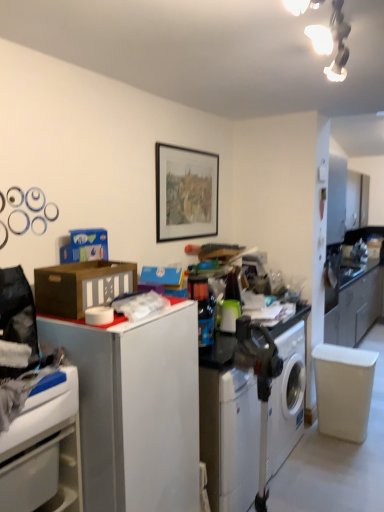
At what (x,y) coordinates should I click in order to perform the action: click on white glossy cabinet at lower left. Please return your answer as a coordinate pair (x, y). Looking at the image, I should click on (44, 452).

What do you see at coordinates (186, 193) in the screenshot? This screenshot has width=384, height=512. I see `matte black picture frame at center` at bounding box center [186, 193].

In order to face matte black picture frame at center, should I rotate leftwards or rightwards?

Rotate your view right by about 0.075°.

Locate an element on the screen. The image size is (384, 512). brown cardboard box at left is located at coordinates (81, 286).

You are a GUI agent. You are given a task and a screenshot of the screen. Output one action in this format:
    pyautogui.click(x=<x>, y=<y>)
    Task: Click on the white matte file cabinet at left
    The image size is (384, 512).
    Given the screenshot: What is the action you would take?
    pyautogui.click(x=136, y=409)

Is brown cardboard box at left inside the boundaries of white matte file cabinet at left, or outside?

brown cardboard box at left is not enclosed by white matte file cabinet at left.

Does brown cardboard box at left come in front of white matte file cabinet at left?

No, it is not.

From a real-world perspective, is brown cardboard box at left on white matte file cabinet at left?

Indeed, from a real-world perspective, brown cardboard box at left stands above white matte file cabinet at left.

Is brown cardboard box at left oriented towards white matte file cabinet at left?

No, brown cardboard box at left is not facing towards white matte file cabinet at left.

Identify the location of picture frame in front of the white plastic washing machine at lower center. (186, 193).

From a real-world perspective, between matte black picture frame at center and white plastic washing machine at lower center, who is vertically lower?

white plastic washing machine at lower center.

Which is behind, point (169, 187) or point (280, 386)?

The point (280, 386) is farther from the camera.

Is there a large distance between matte black picture frame at center and white plastic washing machine at lower center?

matte black picture frame at center is far away from white plastic washing machine at lower center.

In terms of width, does brown cardboard box at left look wider or thinner when compared to white plastic washing machine at lower center?

In the image, brown cardboard box at left appears to be more narrow than white plastic washing machine at lower center.

Is point (64, 311) closer to viewer compared to point (284, 446)?

Yes.

I want to click on cardboard box that is above the white plastic washing machine at lower center (from a real-world perspective), so click(81, 286).

From the image's perspective, relative to white plastic washing machine at lower center, is brown cardboard box at left above or below?

Clearly, from the image's perspective, brown cardboard box at left is above white plastic washing machine at lower center.

Consider the image. How many degrees apart are the facing directions of matte black picture frame at center and brown cardboard box at left?

matte black picture frame at center and brown cardboard box at left are facing 0.524 degrees away from each other.

Looking at this image, is matte black picture frame at center taller or shorter than brown cardboard box at left?

Clearly, matte black picture frame at center is taller compared to brown cardboard box at left.

Is matte black picture frame at center oriented away from brown cardboard box at left?

No, brown cardboard box at left is not at the back of matte black picture frame at center.

Is point (210, 231) closer or farther from the camera than point (98, 290)?

Point (210, 231) appears to be farther away from the viewer than point (98, 290).

Is white matte file cabinet at left completely or partially inside white glossy cabinet at lower left?

No, white matte file cabinet at left is located outside of white glossy cabinet at lower left.

Does white glossy cabinet at lower left have a smaller size compared to white matte file cabinet at left?

Yes.

Can you confirm if white glossy cabinet at lower left is positioned to the right of white matte file cabinet at left?

In fact, white glossy cabinet at lower left is to the left of white matte file cabinet at left.

Considering their positions, is white glossy cabinet at lower left located in front of or behind white matte file cabinet at left?

In the image, white glossy cabinet at lower left appears in front of white matte file cabinet at left.

Is white matte file cabinet at left positioned far away from brown cardboard box at left?

white matte file cabinet at left is actually quite close to brown cardboard box at left.

Does white matte file cabinet at left appear on the left side of brown cardboard box at left?

No, white matte file cabinet at left is not to the left of brown cardboard box at left.

Is white matte file cabinet at left facing away from brown cardboard box at left?

No, white matte file cabinet at left is not facing the opposite direction of brown cardboard box at left.

Is brown cardboard box at left completely or partially inside white matte file cabinet at left?

No.

Is white matte file cabinet at left completely or partially outside of matte black picture frame at center?

Yes, white matte file cabinet at left is outside of matte black picture frame at center.

Between white matte file cabinet at left and matte black picture frame at center, which one has more height?

white matte file cabinet at left.

From the image's perspective, between white matte file cabinet at left and matte black picture frame at center, which one is located above?

matte black picture frame at center is shown above in the image.

What are the coordinates of `cardboard box lying on the left of white matte file cabinet at left` in the screenshot? It's located at (81, 286).

Locate an element on the screen. The width and height of the screenshot is (384, 512). picture frame in front of the white plastic washing machine at lower center is located at coordinates (186, 193).

Looking at this image, when comparing their distances from white matte file cabinet at left, does white glossy cabinet at lower left or brown cardboard box at left seem closer?

Based on the image, white glossy cabinet at lower left appears to be nearer to white matte file cabinet at left.

Estimate the real-world distances between objects in this image. Which object is further from brown cardboard box at left, white plastic washing machine at lower center or matte black picture frame at center?

white plastic washing machine at lower center is positioned further to the anchor brown cardboard box at left.

Estimate the real-world distances between objects in this image. Which object is closer to brown cardboard box at left, white matte file cabinet at left or white plastic washing machine at lower center?

white matte file cabinet at left lies closer to brown cardboard box at left than the other object.

Which object lies further to the anchor point brown cardboard box at left, white glossy cabinet at lower left or white matte file cabinet at left?

white glossy cabinet at lower left.

Based on their spatial positions, is white plastic washing machine at lower center or white glossy cabinet at lower left closer to white matte file cabinet at left?

Based on the image, white glossy cabinet at lower left appears to be nearer to white matte file cabinet at left.

Looking at the image, which one is located closer to white matte file cabinet at left, brown cardboard box at left or matte black picture frame at center?

Based on the image, brown cardboard box at left appears to be nearer to white matte file cabinet at left.

When comparing their distances from white plastic washing machine at lower center, does brown cardboard box at left or white matte file cabinet at left seem closer?

white matte file cabinet at left lies closer to white plastic washing machine at lower center than the other object.

Which object lies nearer to the anchor point brown cardboard box at left, white glossy cabinet at lower left or white plastic washing machine at lower center?

white glossy cabinet at lower left is positioned closer to the anchor brown cardboard box at left.

You are a GUI agent. You are given a task and a screenshot of the screen. Output one action in this format:
    pyautogui.click(x=<x>, y=<y>)
    Task: Click on the cardboard box between matte black picture frame at center and white plastic washing machine at lower center in the vertical direction
    The width and height of the screenshot is (384, 512).
    Given the screenshot: What is the action you would take?
    pyautogui.click(x=81, y=286)

You are a GUI agent. You are given a task and a screenshot of the screen. Output one action in this format:
    pyautogui.click(x=<x>, y=<y>)
    Task: Click on the cardboard box that lies between matte black picture frame at center and white matte file cabinet at left from top to bottom
    The width and height of the screenshot is (384, 512).
    Given the screenshot: What is the action you would take?
    pyautogui.click(x=81, y=286)

This screenshot has height=512, width=384. Identify the location of file cabinet between white glossy cabinet at lower left and white plastic washing machine at lower center in the front-back direction. (136, 409).

In order to click on cabinetry between matte black picture frame at center and white matte file cabinet at left in the vertical direction in this screenshot , I will do `click(44, 452)`.